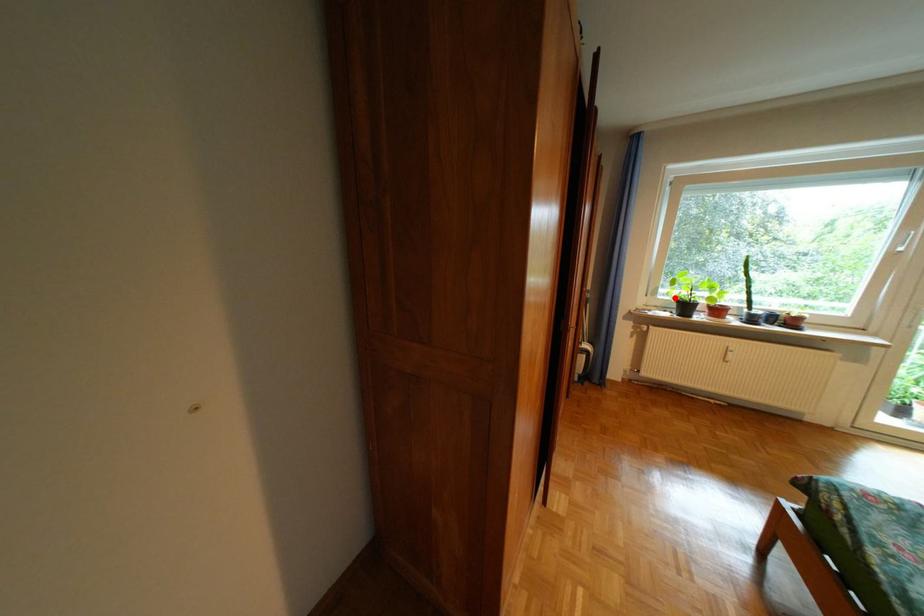
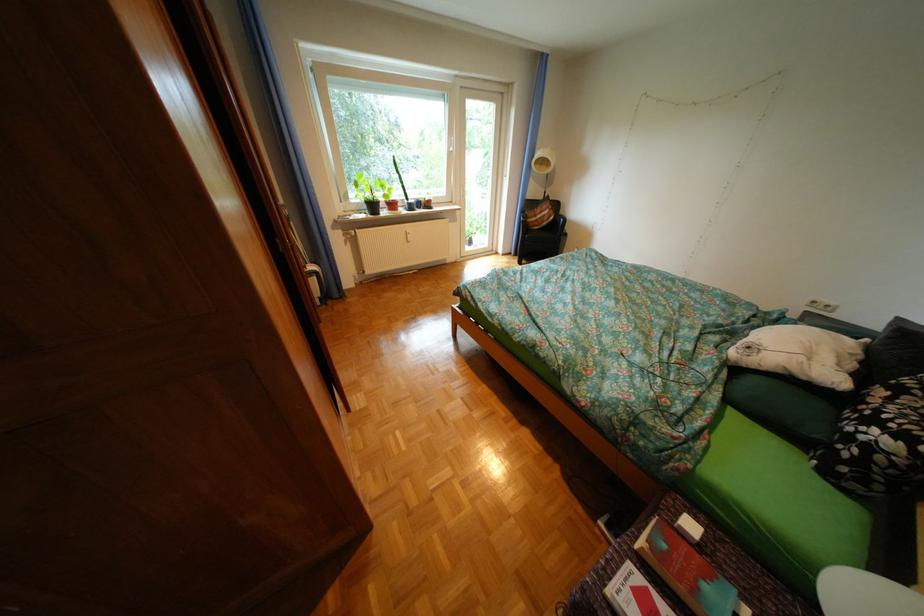
Question: I am providing you with two images of the same scene from different viewpoints. Image1 has a red point marked. In image2, the corresponding 3D location appears at what relative position? Reply with the corresponding letter.

Choices:
 (A) Closer
 (B) Farther

Answer: (A)